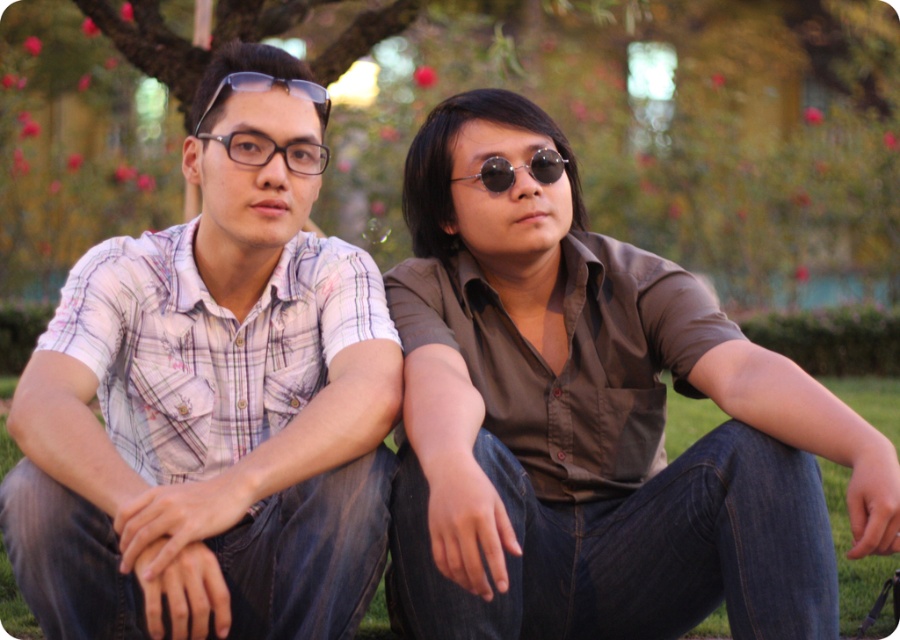
Between plaid cotton shirt at left and sunglasses at center, which one has more height?

plaid cotton shirt at left is taller.

Can you confirm if plaid cotton shirt at left is positioned to the right of sunglasses at center?

Incorrect, plaid cotton shirt at left is not on the right side of sunglasses at center.

This screenshot has height=640, width=900. What do you see at coordinates (212, 404) in the screenshot? I see `plaid cotton shirt at left` at bounding box center [212, 404].

You are a GUI agent. You are given a task and a screenshot of the screen. Output one action in this format:
    pyautogui.click(x=<x>, y=<y>)
    Task: Click on the plaid cotton shirt at left
    The width and height of the screenshot is (900, 640).
    Given the screenshot: What is the action you would take?
    pyautogui.click(x=212, y=404)

Between matte brown shirt at center and sunglasses at center, which one has more height?

Standing taller between the two is matte brown shirt at center.

Can you confirm if matte brown shirt at center is wider than sunglasses at center?

Indeed, matte brown shirt at center has a greater width compared to sunglasses at center.

The image size is (900, 640). What are the coordinates of `matte brown shirt at center` in the screenshot? It's located at (594, 422).

Can you confirm if matte brown shirt at center is thinner than matte black glasses at center?

In fact, matte brown shirt at center might be wider than matte black glasses at center.

Does matte brown shirt at center come in front of matte black glasses at center?

→ Yes, it is in front of matte black glasses at center.

This screenshot has height=640, width=900. Find the location of `matte brown shirt at center`. matte brown shirt at center is located at coordinates (594, 422).

You are a GUI agent. You are given a task and a screenshot of the screen. Output one action in this format:
    pyautogui.click(x=<x>, y=<y>)
    Task: Click on the matte brown shirt at center
    The width and height of the screenshot is (900, 640).
    Given the screenshot: What is the action you would take?
    pyautogui.click(x=594, y=422)